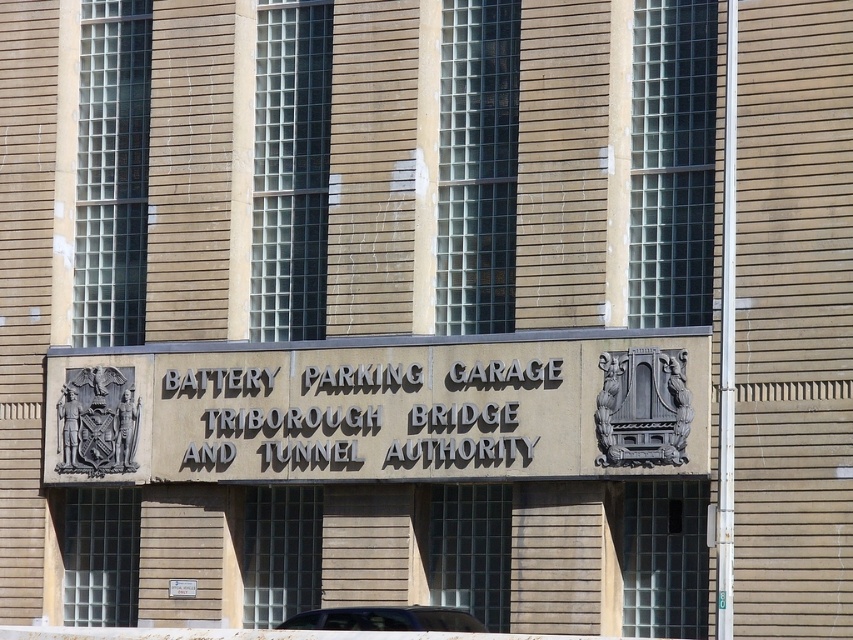
You are a visitor approaching the Battery Parking Garage and see both the black stone sign at center and the metallic sign at center. Which sign is located to the right when facing the building?

The black stone sign at center is positioned on the right side of the metallic sign at center, so when facing the building, the black stone sign at center is to the right of the metallic sign at center.

Consider the image. You are standing at the entrance of the Battery Parking Garage and want to locate a specific point marked on the facade. The point is located at coordinates point (216, 380). Given that you are 62.13 meters away from this point, can you estimate how far you need to walk forward to reach the base of the building?

The point (216, 380) is 62.13 meters away from the camera. To reach the base of the building, you need to walk forward 62.13 meters.

What are the coordinates of the black stone sign at center?

The coordinates of the black stone sign at center are 0.650 in the x axis and 0.420 in the y axis.